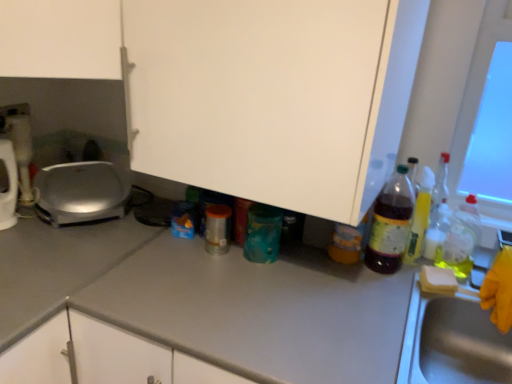
Find the location of a particular element. free space in front of silver metallic waffle maker at left, the first appliance viewed from the right is located at coordinates (61, 251).